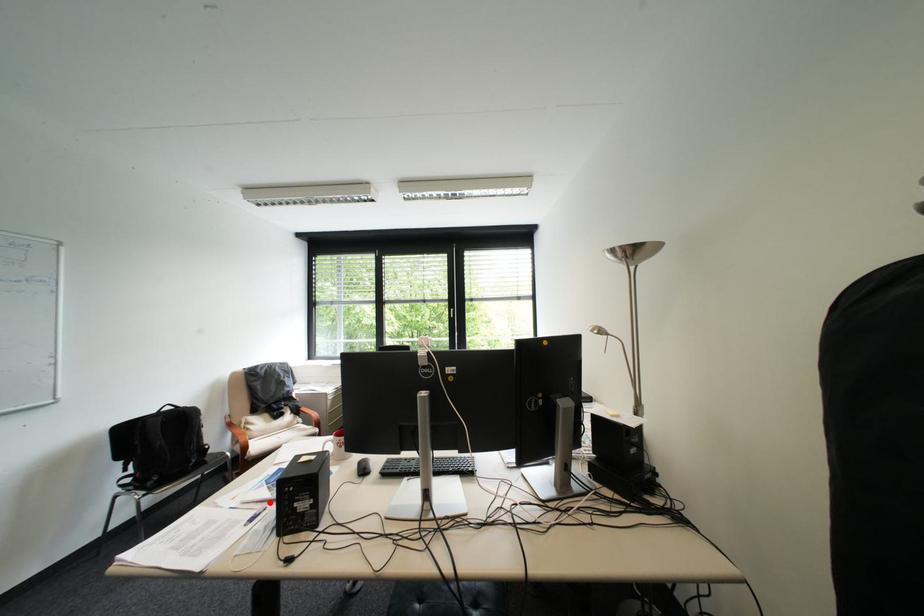
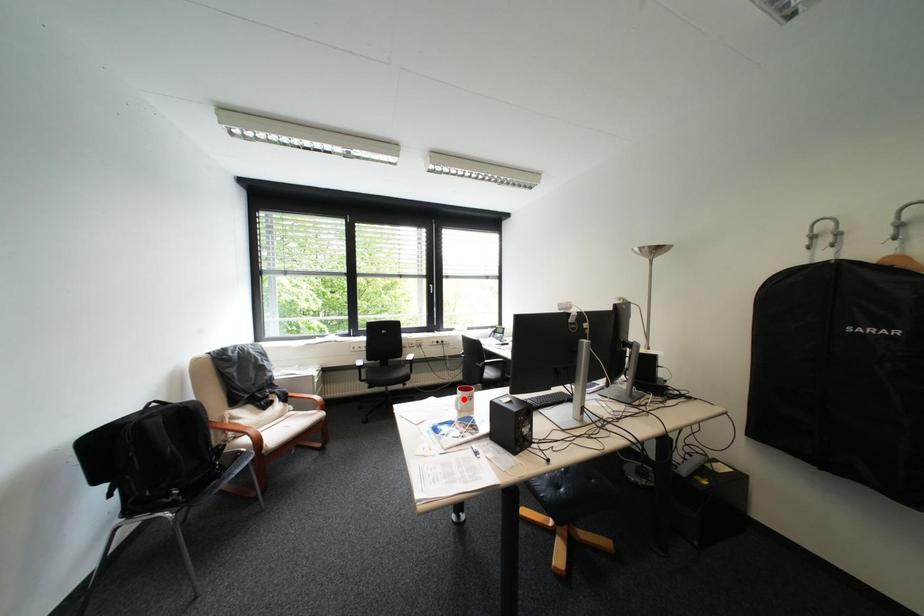
I am providing you with two images of the same scene from different viewpoints. A red point is marked on the first image and another point is marked on the second image. Is the red point in image1 aligned with the point shown in image2?

No